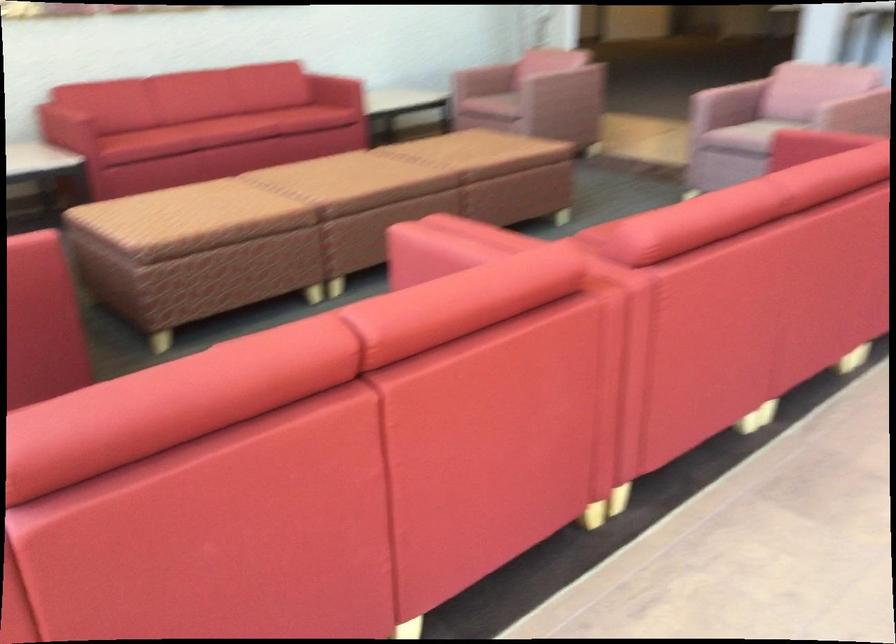
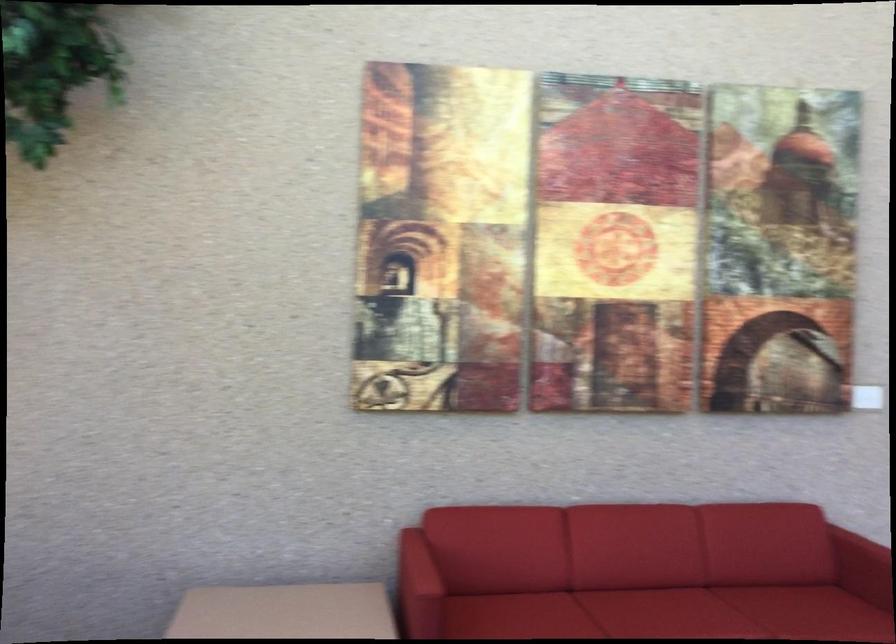
In the second image, find the point that corresponds to pixel 218 118 in the first image.

(659, 607)